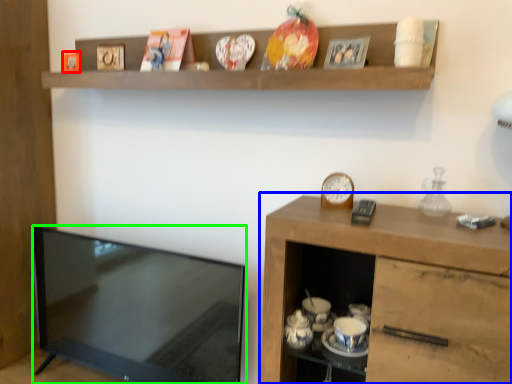
Question: Which is nearer to the picture frame (highlighted by a red box)? cabinetry (highlighted by a blue box) or television (highlighted by a green box).

Choices:
 (A) cabinetry
 (B) television

Answer: (B)